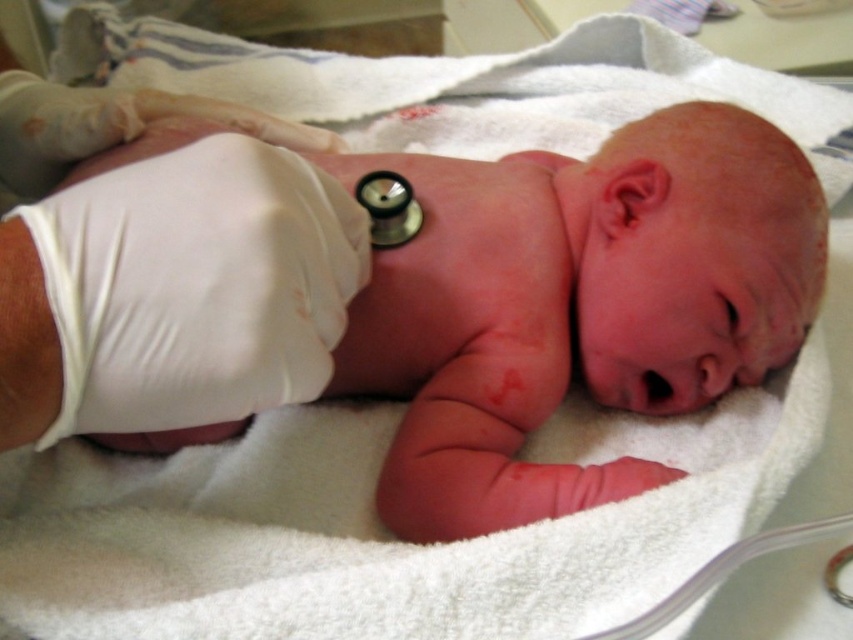
Question: From the image, what is the correct spatial relationship of pink smooth skin at center in relation to white latex glove at center?

Choices:
 (A) left
 (B) right

Answer: (B)

Question: Is pink smooth skin at center closer to the viewer compared to white latex glove at center?

Choices:
 (A) no
 (B) yes

Answer: (A)

Question: Can you confirm if pink smooth skin at center is wider than white latex glove at center?

Choices:
 (A) no
 (B) yes

Answer: (B)

Question: Among these points, which one is nearest to the camera?

Choices:
 (A) (679, 150)
 (B) (108, 246)

Answer: (B)

Question: Among these objects, which one is farthest from the camera?

Choices:
 (A) pink smooth skin at center
 (B) white latex glove at center

Answer: (A)

Question: Which of the following is the farthest from the observer?

Choices:
 (A) pink smooth skin at center
 (B) white latex glove at center

Answer: (A)